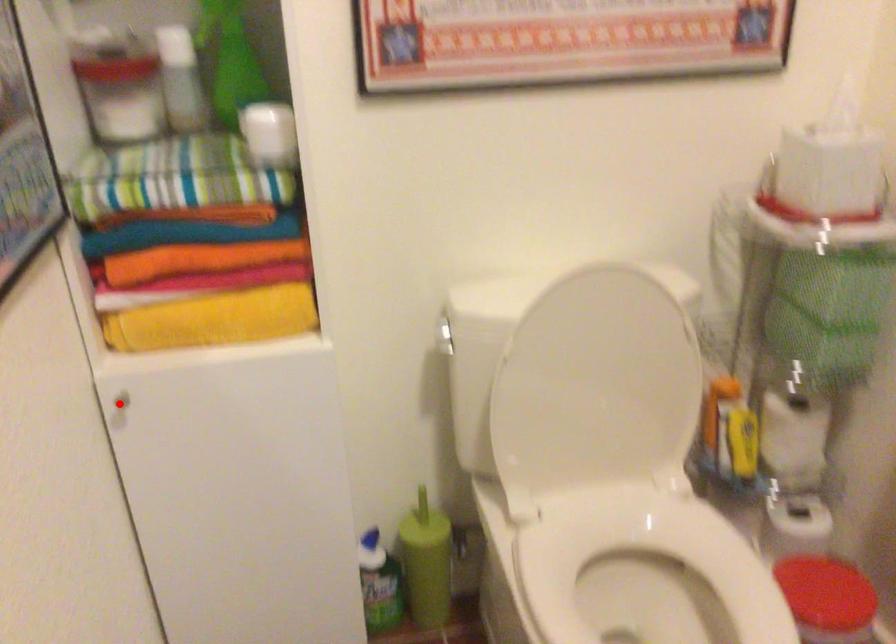
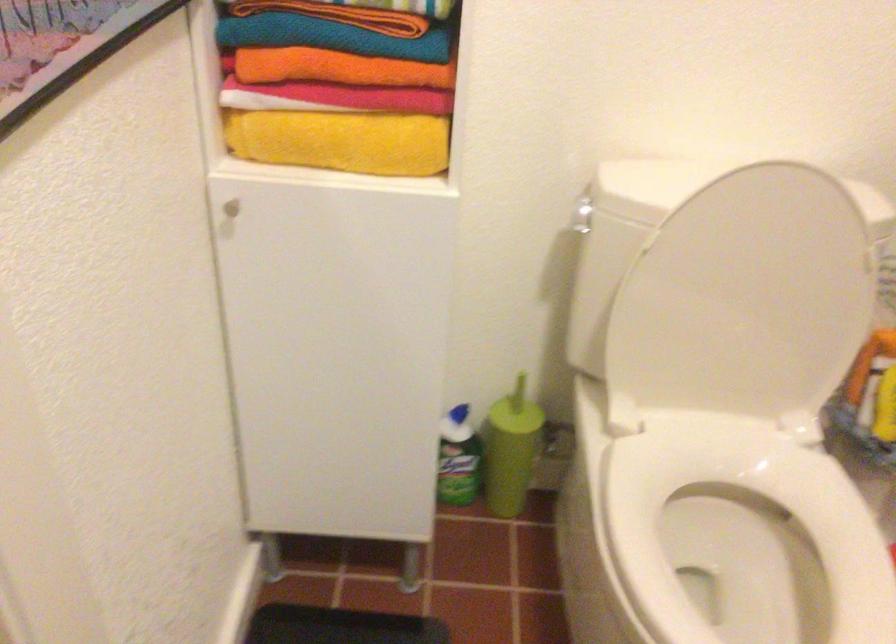
Question: I am providing you with two images of the same scene from different viewpoints. A red point is marked on the first image. Can you still see the location of the red point in image 2?

Choices:
 (A) Yes
 (B) No

Answer: (A)